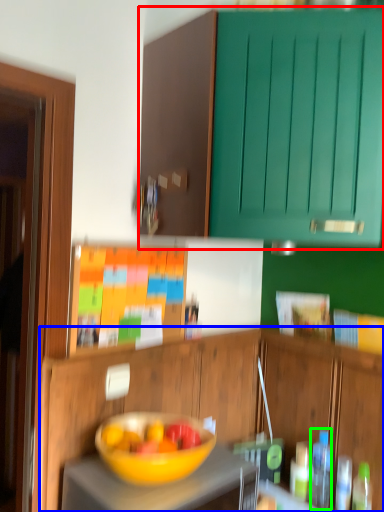
Question: Which object is positioned closest to cabinetry (highlighted by a red box)? Select from cabinetry (highlighted by a blue box) and bottle (highlighted by a green box).

Choices:
 (A) cabinetry
 (B) bottle

Answer: (A)